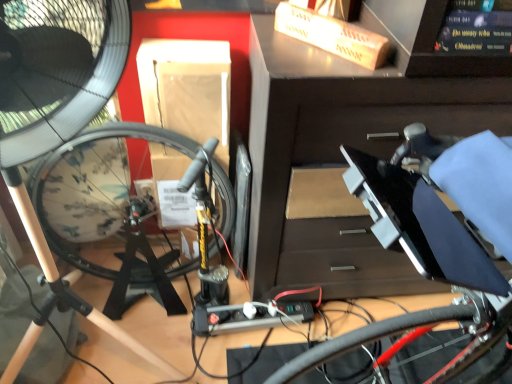
Question: Considering the positions of black plastic workbench at center and shiny red bicycle wheel at lower right in the image, is black plastic workbench at center wider or thinner than shiny red bicycle wheel at lower right?

Choices:
 (A) thin
 (B) wide

Answer: (A)

Question: Is black plastic workbench at center to the left or to the right of shiny red bicycle wheel at lower right in the image?

Choices:
 (A) left
 (B) right

Answer: (B)

Question: Which of these objects is positioned closest to the black plastic workbench at center?

Choices:
 (A) black glossy book at upper right
 (B) black matte fan at left
 (C) shiny red bicycle wheel at lower right

Answer: (A)

Question: Which is farther from the shiny red bicycle wheel at lower right?

Choices:
 (A) black plastic workbench at center
 (B) black glossy book at upper right
 (C) black matte fan at left

Answer: (C)